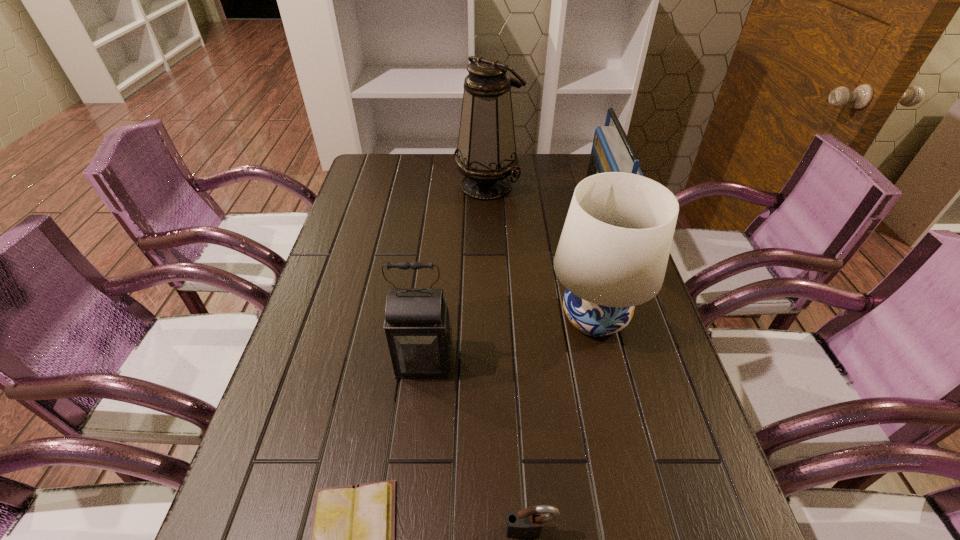
The image size is (960, 540). In order to click on free spot located 0.350m on the front panel of the radio receiver in this screenshot , I will do `click(477, 213)`.

Locate an element on the screen. The height and width of the screenshot is (540, 960). free space located on the front panel of the radio receiver is located at coordinates click(x=527, y=213).

You are a GUI agent. You are given a task and a screenshot of the screen. Output one action in this format:
    pyautogui.click(x=<x>, y=<y>)
    Task: Click on the free location located on the front panel of the radio receiver
    
    Given the screenshot: What is the action you would take?
    point(492,213)

Find the location of `oil lamp that is positioned at the far edge`. oil lamp that is positioned at the far edge is located at coordinates (486, 155).

Where is `radio receiver situated at the far edge`? radio receiver situated at the far edge is located at coordinates (611, 151).

Image resolution: width=960 pixels, height=540 pixels. I want to click on lampshade that is at the right edge, so click(612, 255).

What are the coordinates of `radio receiver present at the right edge` in the screenshot? It's located at (611, 151).

At what (x,y) coordinates should I click in order to perform the action: click on object situated at the far right corner. Please return your answer as a coordinate pair (x, y). The width and height of the screenshot is (960, 540). Looking at the image, I should click on (611, 151).

Where is `vacant space at the far edge`? This screenshot has width=960, height=540. vacant space at the far edge is located at coordinates (540, 160).

Where is `free space at the left edge`? The width and height of the screenshot is (960, 540). free space at the left edge is located at coordinates (323, 361).